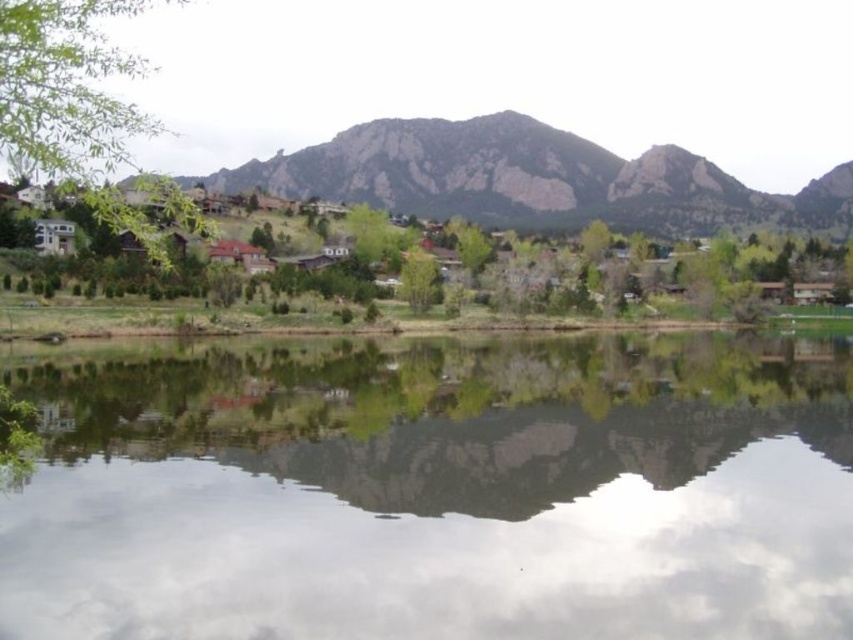
Question: Does rugged brown mountain at center appear over green leafy tree at left?

Choices:
 (A) no
 (B) yes

Answer: (B)

Question: Which of the following is the farthest from the observer?

Choices:
 (A) (648, 228)
 (B) (419, 284)

Answer: (A)

Question: Does transparent water at center have a lesser width compared to rugged brown mountain at center?

Choices:
 (A) no
 (B) yes

Answer: (B)

Question: Which object is positioned farthest from the green leafy tree at left?

Choices:
 (A) rugged brown mountain at center
 (B) transparent water at center

Answer: (A)

Question: Which object appears farthest from the camera in this image?

Choices:
 (A) transparent water at center
 (B) green leafy tree at center
 (C) rugged brown mountain at center

Answer: (C)

Question: Observing the image, what is the correct spatial positioning of rugged brown mountain at center in reference to green leafy tree at left?

Choices:
 (A) left
 (B) right

Answer: (B)